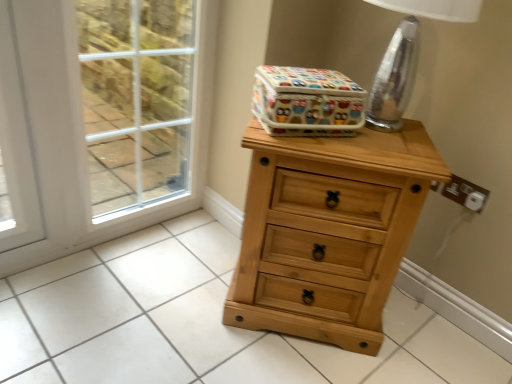
Identify the location of vacant area in front of natural wood chest of drawers at center. (285, 362).